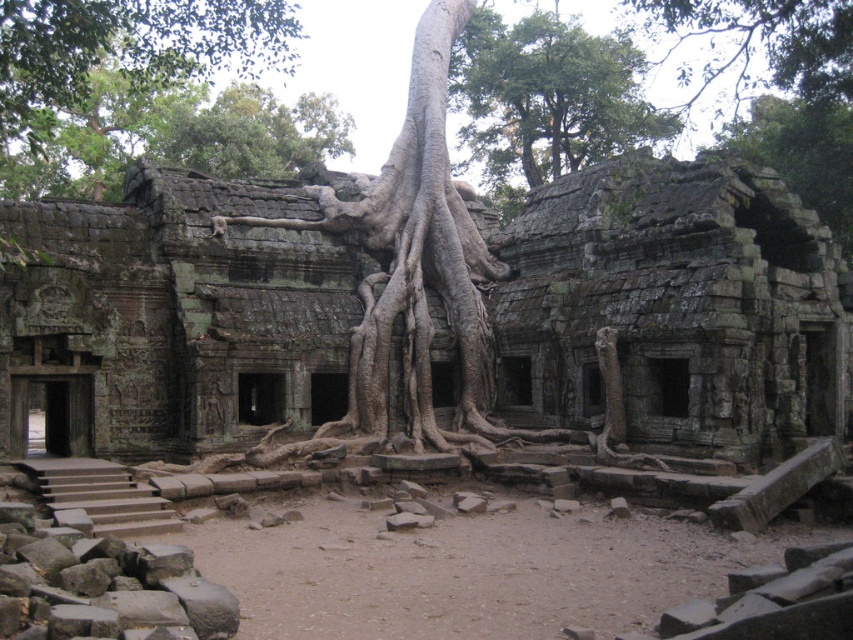
Question: Can you confirm if gray stone ruins at center is positioned to the right of green rough bark tree at upper center?

Choices:
 (A) yes
 (B) no

Answer: (B)

Question: Which object is farther from the camera taking this photo?

Choices:
 (A) green leafy tree at upper center
 (B) green rough bark tree at upper center
 (C) gray rough stone tree trunk at center

Answer: (A)

Question: Estimate the real-world distances between objects in this image. Which object is closer to the gray stone ruins at center?

Choices:
 (A) green mossy roots at upper right
 (B) green rough bark tree at upper center
 (C) green leafy tree at upper center

Answer: (A)

Question: Can you confirm if gray stone ruins at center is positioned to the left of green mossy roots at upper right?

Choices:
 (A) no
 (B) yes

Answer: (B)

Question: Does gray rough stone tree trunk at center have a greater width compared to green rough bark tree at upper center?

Choices:
 (A) no
 (B) yes

Answer: (A)

Question: Which object is farther from the camera taking this photo?

Choices:
 (A) green leafy tree at upper center
 (B) gray rough stone tree trunk at center
 (C) green mossy roots at upper right

Answer: (A)